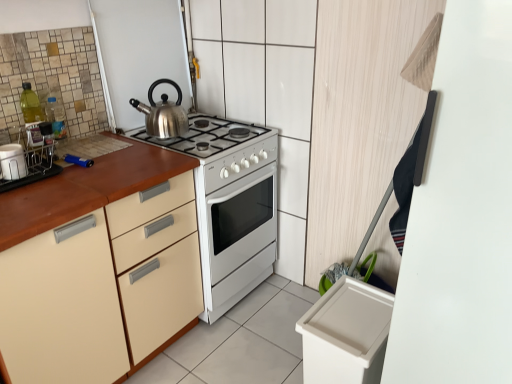
Question: Relative to matte white container at left, is satin silver kettle at upper center in front or behind?

Choices:
 (A) front
 (B) behind

Answer: (B)

Question: Looking at their shapes, would you say satin silver kettle at upper center is wider or thinner than matte white container at left?

Choices:
 (A) wide
 (B) thin

Answer: (A)

Question: Estimate the real-world distances between objects in this image. Which object is closer to the matte wood cabinet at left?

Choices:
 (A) satin silver kettle at upper center
 (B) matte white container at left
 (C) white glossy stove at center

Answer: (C)

Question: Which object is the farthest from the matte white container at left?

Choices:
 (A) matte wood cabinet at left
 (B) satin silver kettle at upper center
 (C) white glossy stove at center

Answer: (C)